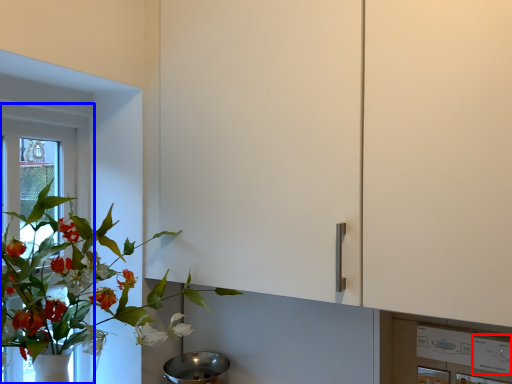
Question: Which point is further to the camera, appliance (highlighted by a red box) or window frame (highlighted by a blue box)?

Choices:
 (A) appliance
 (B) window frame

Answer: (B)